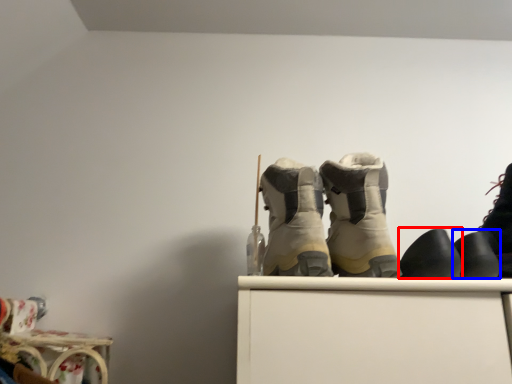
Question: Which point is closer to the camera, footwear (highlighted by a red box) or footwear (highlighted by a blue box)?

Choices:
 (A) footwear
 (B) footwear

Answer: (A)